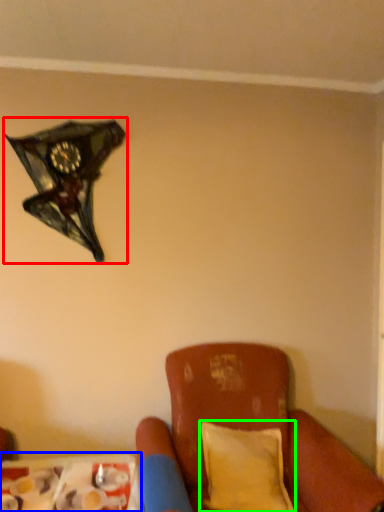
Question: Which is farther away from lamp (highlighted by a red box)? table (highlighted by a blue box) or pillow (highlighted by a green box)?

Choices:
 (A) table
 (B) pillow

Answer: (B)